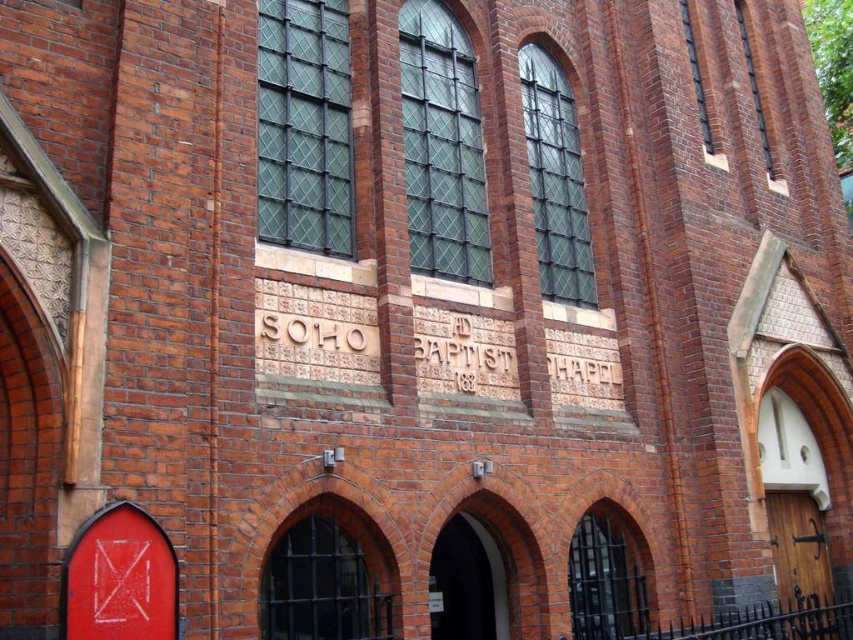
Question: Which of the following is the closest to the observer?

Choices:
 (A) wooden door at right
 (B) smooth red door at lower left

Answer: (B)

Question: Does smooth red door at lower left have a smaller size compared to wooden door at right?

Choices:
 (A) no
 (B) yes

Answer: (B)

Question: Is smooth red door at lower left below wooden door at right?

Choices:
 (A) yes
 (B) no

Answer: (B)

Question: Which point is farther to the camera?

Choices:
 (A) wooden door at right
 (B) smooth red door at lower left

Answer: (A)

Question: Which object appears closest to the camera in this image?

Choices:
 (A) smooth red door at lower left
 (B) wooden door at right

Answer: (A)

Question: Does smooth red door at lower left have a larger size compared to wooden door at right?

Choices:
 (A) no
 (B) yes

Answer: (A)